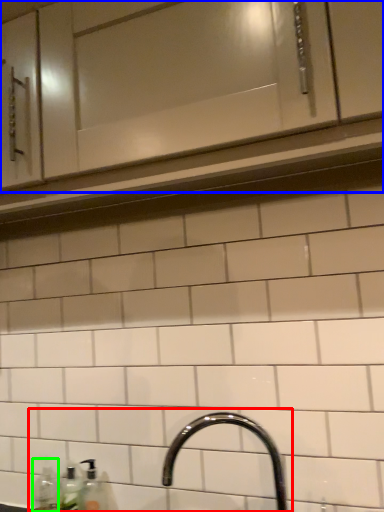
Question: Which is farther away from sink (highlighted by a red box)? cabinetry (highlighted by a blue box) or bottle (highlighted by a green box)?

Choices:
 (A) cabinetry
 (B) bottle

Answer: (A)